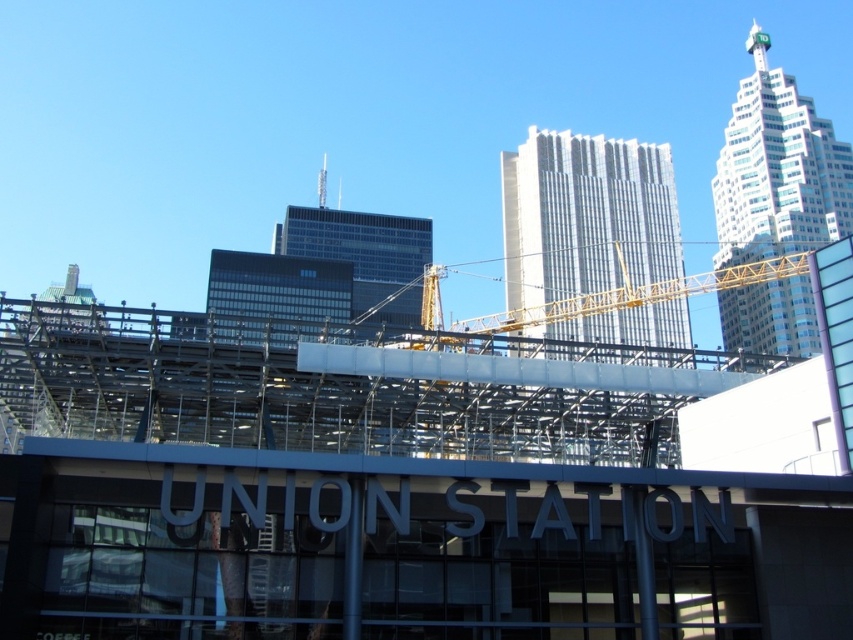
Looking at this image, you are standing in front of the UNION STATION building and want to reach a specific point marked at coordinates point (666,337). If your current position is 100 feet away from the building, can you determine whether the point is closer to you or farther away than the building itself?

The distance of point (666,337) from viewer is 462.05 feet, which is farther away than the building itself at 100 feet. Therefore, the point is farther away from you than the building.

You are a construction worker standing at the yellow metallic crane at center. You need to deliver materials to the white glass skyscraper at upper right. Can you safely throw the materials directly to the workers there without any obstacles? Explain your reasoning.

The white glass skyscraper at upper right is 101.61 feet away from the yellow metallic crane at center. Throwing materials over this distance is not feasible due to the significant distance and potential safety hazards, so you should use a safer method like a crane or elevator to transport the materials.

You are a drone operator tasked with flying a drone between the silver glass skyscraper at center and the white glass skyscraper at upper right. The drone has a wingspan of 8 feet. What is the minimum distance you need to maintain between the drone and each building to ensure safe passage?

The minimum distance required between the drone and each building would be half of the drone wingspan, which is 4 feet. This ensures the drone stays clear of both the silver glass skyscraper at center and the white glass skyscraper at upper right while maintaining a safe 8 feet separation overall.